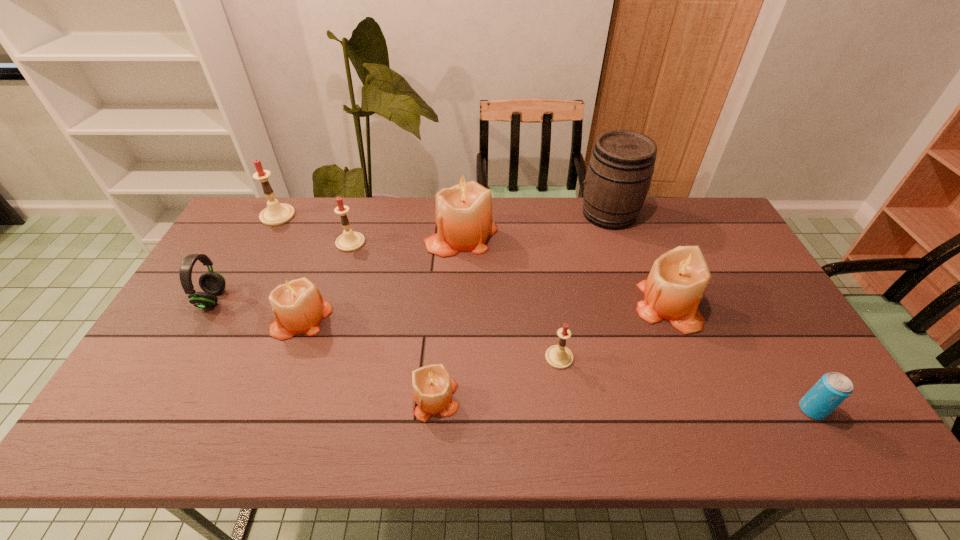
This screenshot has width=960, height=540. Identify the location of object that is at the right edge. (833, 388).

Find the location of a particular element. The height and width of the screenshot is (540, 960). object at the far left corner is located at coordinates (275, 213).

Find the location of a particular element. object located at the near right corner is located at coordinates (833, 388).

In order to click on vacant space at the far edge in this screenshot , I will do `click(541, 200)`.

The image size is (960, 540). I want to click on vacant space at the near edge of the desktop, so click(550, 420).

Locate an element on the screen. vacant space at the left edge of the desktop is located at coordinates (183, 391).

Locate an element on the screen. Image resolution: width=960 pixels, height=540 pixels. free space at the right edge is located at coordinates (760, 316).

The width and height of the screenshot is (960, 540). I want to click on vacant area at the far left corner of the desktop, so click(245, 211).

You are a GUI agent. You are given a task and a screenshot of the screen. Output one action in this format:
    pyautogui.click(x=<x>, y=<y>)
    Task: Click on the free space at the near left corner of the desktop
    
    Given the screenshot: What is the action you would take?
    pyautogui.click(x=103, y=438)

Where is `free space between the nearest candle and the biggest beige candle`? free space between the nearest candle and the biggest beige candle is located at coordinates (448, 318).